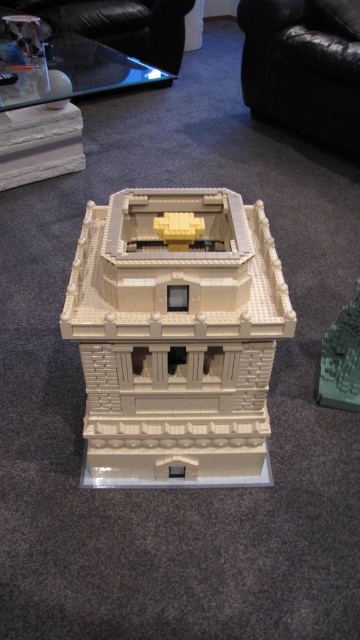
Can you confirm if beige lego tower at center is positioned above green matte brick at right?

No, beige lego tower at center is not above green matte brick at right.

Is point (168, 451) less distant than point (344, 321)?

That is True.

Find the location of a particular element. The width and height of the screenshot is (360, 640). beige lego tower at center is located at coordinates (176, 333).